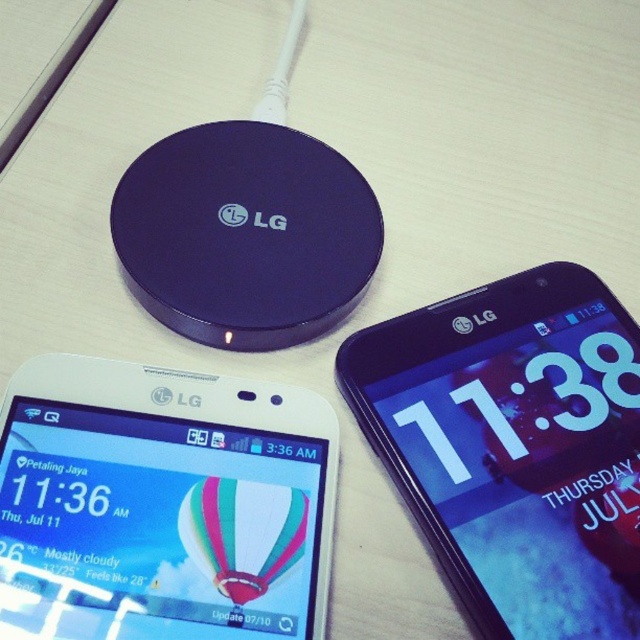
You are a delivery person who needs to place a small package between the white glossy phone at lower left and the black glossy smartphone at upper right. Can you fit the package if it measures 12 inches in length?

The distance between the white glossy phone at lower left and the black glossy smartphone at upper right is 13.31 inches, so a 12 inch package can fit between them.

Please provide the 2D coordinates of the black glossy smartphone at upper right in the image.

The 2D coordinates of the black glossy smartphone at upper right are at point (515, 445).

You are trying to place the black glossy smartphone at upper right onto the purple glossy lg wireless charger at upper center. Based on their sizes, will the smartphone fit on the charger?

The black glossy smartphone at upper right might be wider than purple glossy lg wireless charger at upper center, so it may not fit properly.